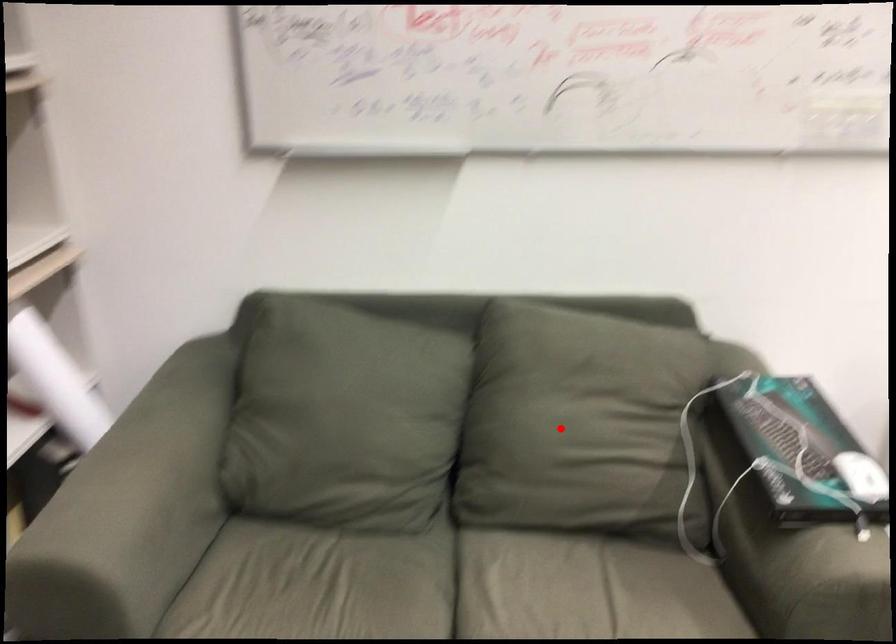
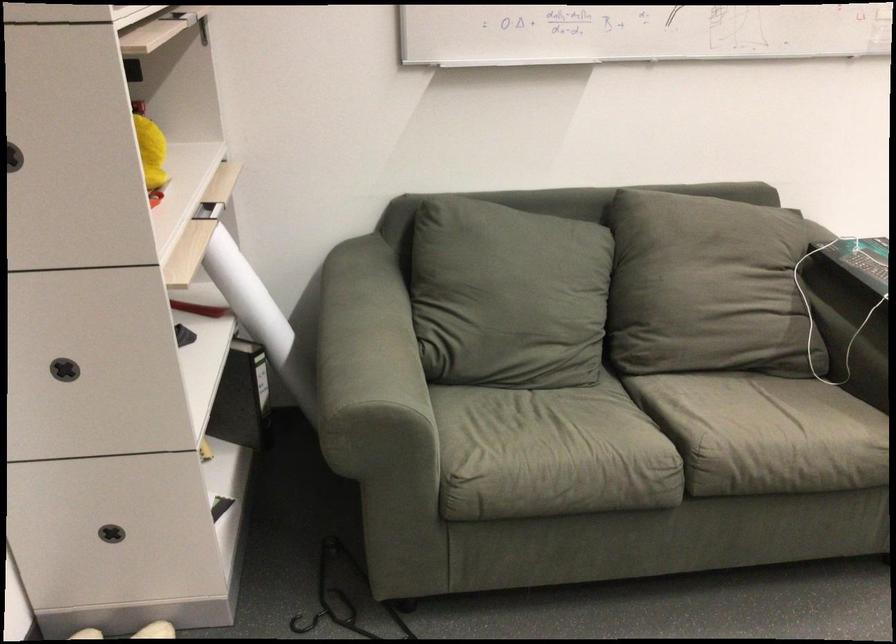
Question: I am providing you with two images of the same scene from different viewpoints. In image1, a red point is highlighted. Considering the same 3D point in image2, which of the following is correct?

Choices:
 (A) It is closer
 (B) It is farther

Answer: (B)